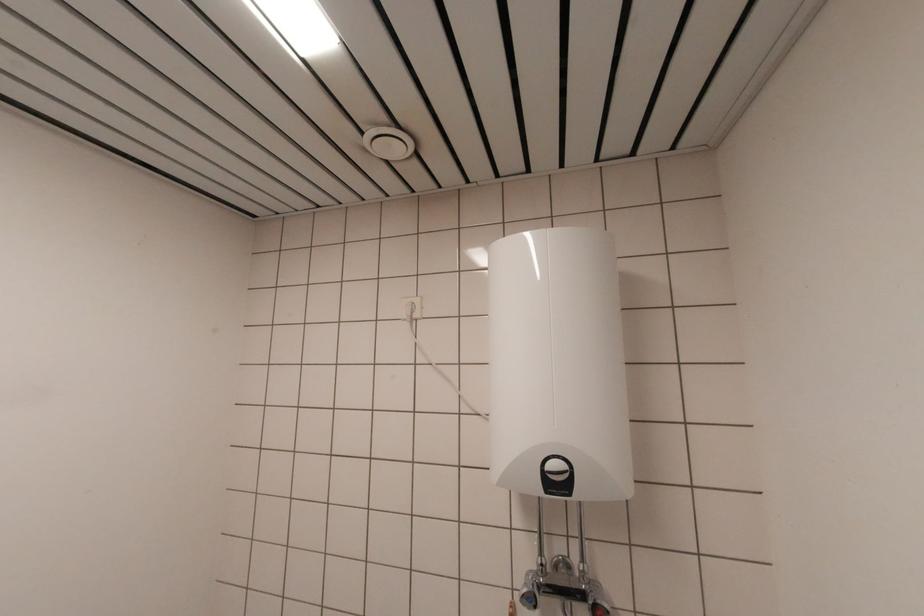
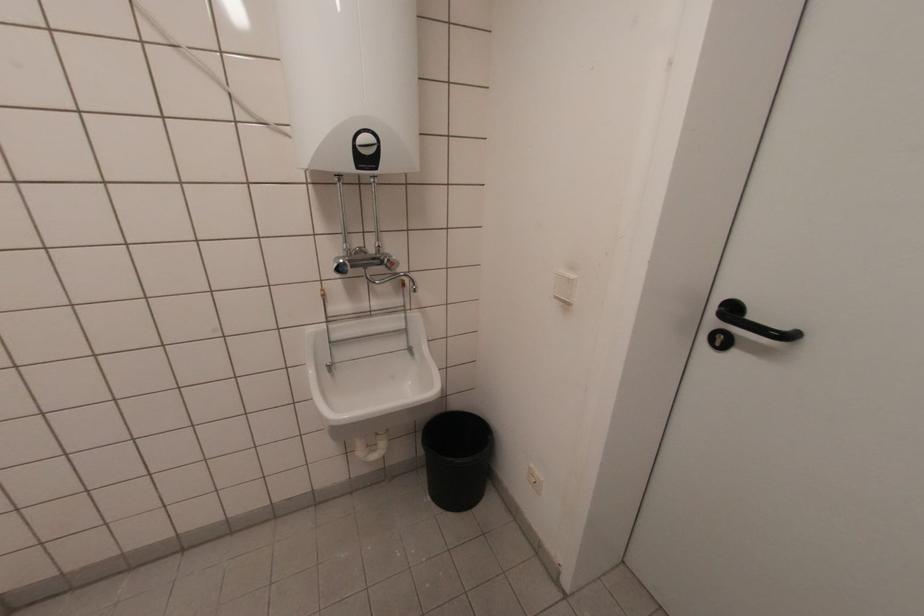
The point at (590, 582) is marked in the first image. Where is the corresponding point in the second image?

(383, 254)